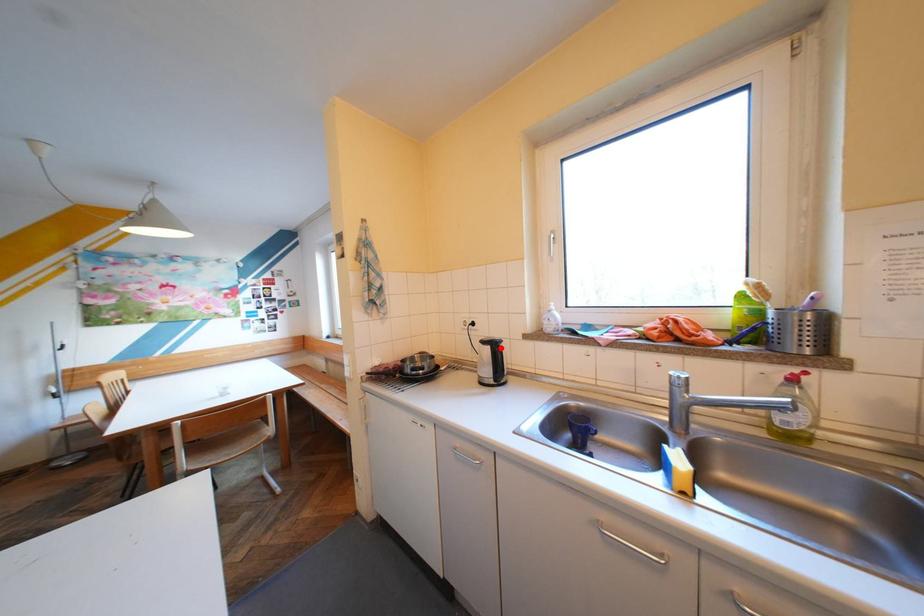
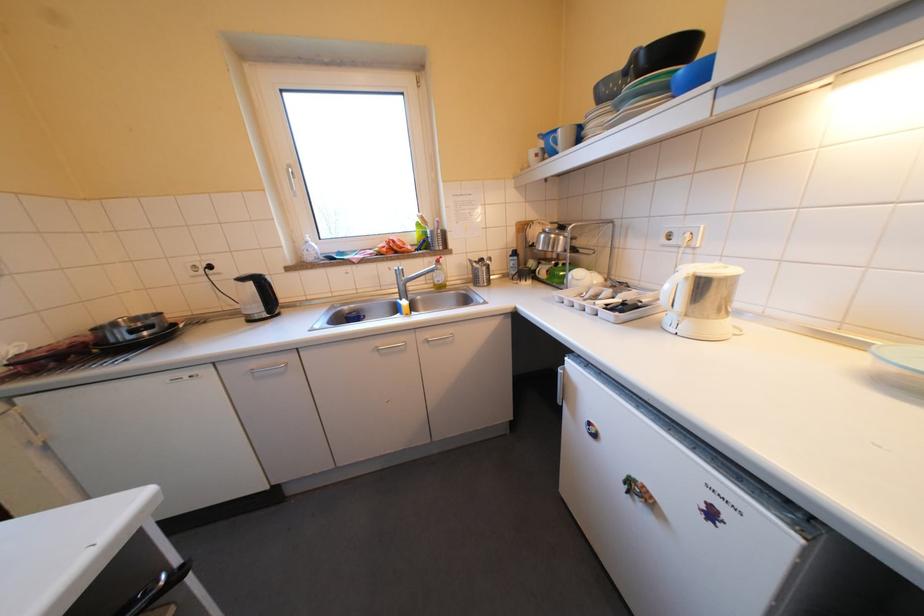
Where in the second image is the point corresponding to the highlighted location from the first image?

(263, 284)